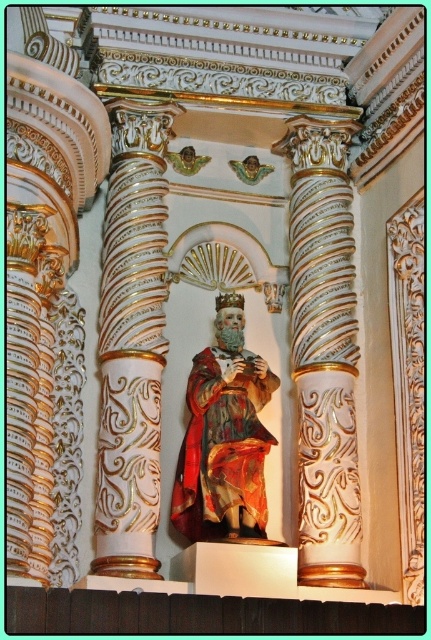
Question: Does white glossy column at center have a greater width compared to red velvet robe at center?

Choices:
 (A) no
 (B) yes

Answer: (B)

Question: Which point is closer to the camera?

Choices:
 (A) red velvet robe at center
 (B) white marble column at center
 (C) white glossy column at center

Answer: (C)

Question: Considering the relative positions of white marble column at center and red velvet robe at center in the image provided, where is white marble column at center located with respect to red velvet robe at center?

Choices:
 (A) below
 (B) above

Answer: (B)

Question: Which object appears farthest from the camera in this image?

Choices:
 (A) white glossy column at center
 (B) white marble column at center

Answer: (B)

Question: Can you confirm if white marble column at center is positioned below red velvet robe at center?

Choices:
 (A) no
 (B) yes

Answer: (A)

Question: Which of the following is the farthest from the observer?

Choices:
 (A) (218, 484)
 (B) (99, 541)

Answer: (A)